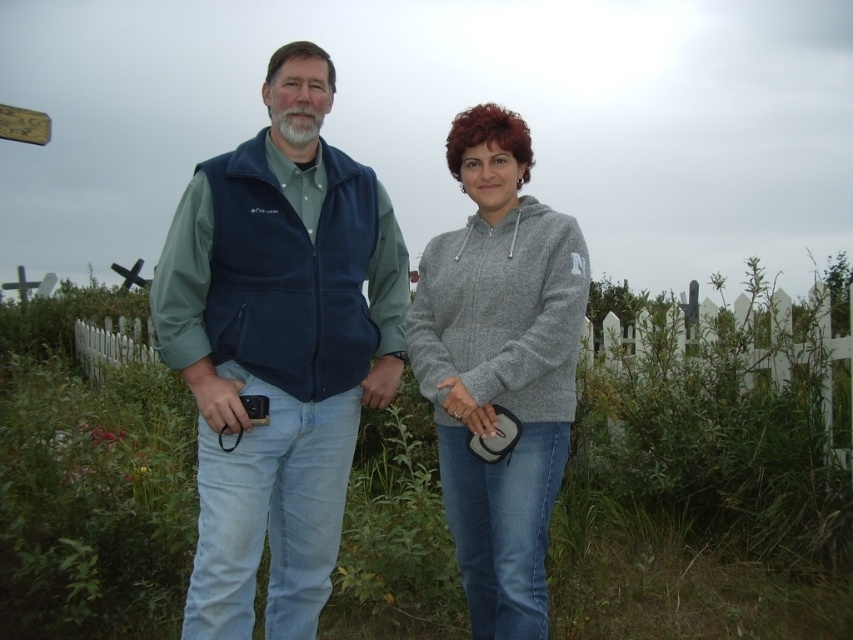
Question: Which point is closer to the camera?

Choices:
 (A) (479, 148)
 (B) (303, 531)

Answer: (B)

Question: Which point appears closest to the camera in this image?

Choices:
 (A) (451, 132)
 (B) (296, 541)

Answer: (B)

Question: Can you confirm if navy blue fleece vest at center is positioned to the right of gray fleece hoodie at center?

Choices:
 (A) no
 (B) yes

Answer: (A)

Question: Does navy blue fleece vest at center appear on the left side of gray fleece hoodie at center?

Choices:
 (A) no
 (B) yes

Answer: (B)

Question: Is the position of navy blue fleece vest at center less distant than that of gray fleece hoodie at center?

Choices:
 (A) no
 (B) yes

Answer: (B)